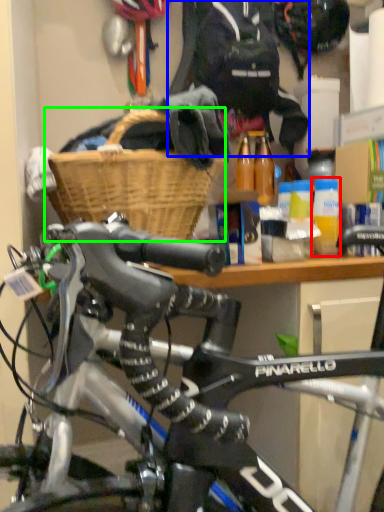
Question: Estimate the real-world distances between objects in this image. Which object is closer to bottle (highlighted by a red box), clothing (highlighted by a blue box) or basket (highlighted by a green box)?

Choices:
 (A) clothing
 (B) basket

Answer: (B)